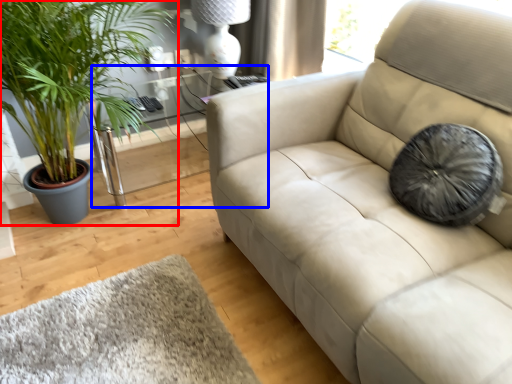
Question: Which object appears closest to the camera in this image, houseplant (highlighted by a red box) or table (highlighted by a blue box)?

Choices:
 (A) houseplant
 (B) table

Answer: (A)